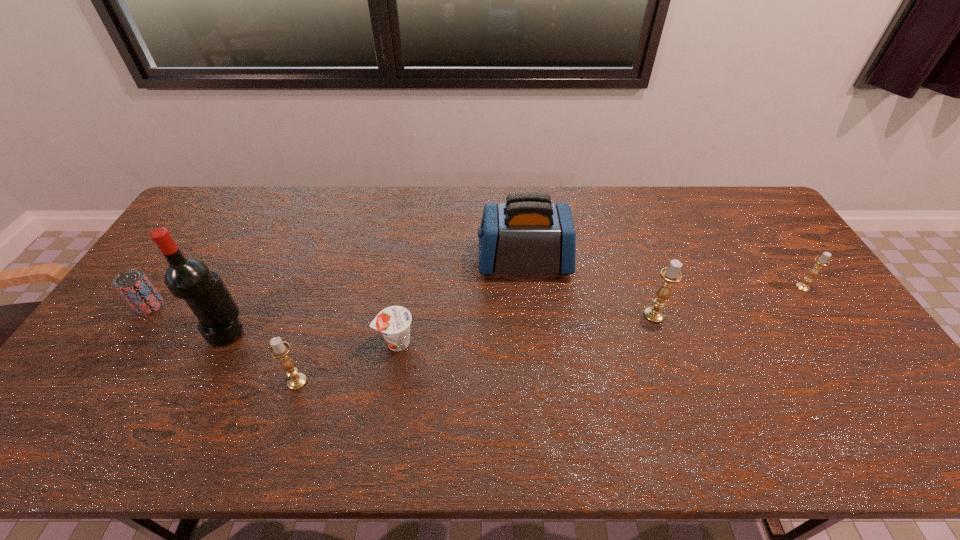
Locate which candle holder ranks in proximity to the tallest candle holder. Please provide its 2D coordinates. Your answer should be formatted as a tuple, i.e. [(x, y)], where the tuple contains the x and y coordinates of a point satisfying the conditions above.

[(821, 261)]

Find the location of `candle holder that is the closest one to the shortest candle holder`. candle holder that is the closest one to the shortest candle holder is located at coordinates point(671,274).

Locate an element on the screen. This screenshot has height=540, width=960. free space that satisfies the following two spatial constraints: 1. on the front-facing side of the third object from right to left; 2. on the back side of the shortest candle holder is located at coordinates (526, 287).

The width and height of the screenshot is (960, 540). Identify the location of blank area in the image that satisfies the following two spatial constraints: 1. on the front side of the nearest object; 2. on the left side of the sixth tallest object. (98, 381).

The image size is (960, 540). Find the location of `free space that satisfies the following two spatial constraints: 1. on the front-facing side of the farthest object; 2. on the back side of the second candle holder from right to left`. free space that satisfies the following two spatial constraints: 1. on the front-facing side of the farthest object; 2. on the back side of the second candle holder from right to left is located at coordinates (529, 315).